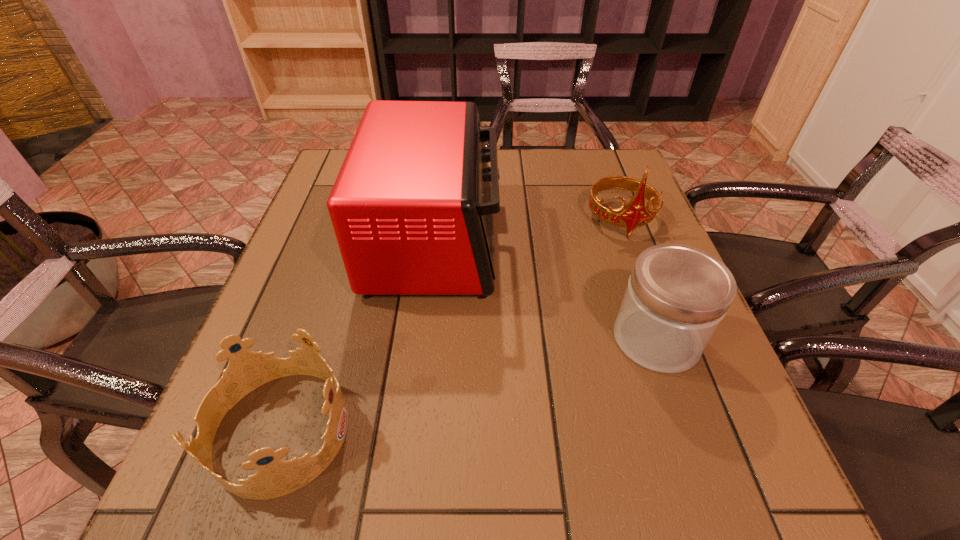
Identify the location of object at the far edge. This screenshot has width=960, height=540. (412, 207).

Identify the location of object that is at the near edge. (247, 370).

Locate an element on the screen. The height and width of the screenshot is (540, 960). object positioned at the left edge is located at coordinates (247, 370).

Where is `tiara that is at the right edge`? This screenshot has width=960, height=540. tiara that is at the right edge is located at coordinates click(x=636, y=213).

Locate an element on the screen. The image size is (960, 540). jar situated at the right edge is located at coordinates (676, 297).

What are the coordinates of `object positioned at the near left corner` in the screenshot? It's located at (247, 370).

Where is `free region at the near edge`? Image resolution: width=960 pixels, height=540 pixels. free region at the near edge is located at coordinates (374, 458).

The height and width of the screenshot is (540, 960). In order to click on vacant space at the left edge of the desktop in this screenshot , I will do `click(311, 207)`.

At what (x,y) coordinates should I click in order to perform the action: click on vacant space at the right edge of the desktop. Please return your answer as a coordinate pair (x, y). The height and width of the screenshot is (540, 960). Looking at the image, I should click on (606, 268).

You are a GUI agent. You are given a task and a screenshot of the screen. Output one action in this format:
    pyautogui.click(x=<x>, y=<y>)
    Task: Click on the vacant space at the near left corner of the desktop
    This screenshot has width=960, height=540.
    Given the screenshot: What is the action you would take?
    pyautogui.click(x=210, y=476)